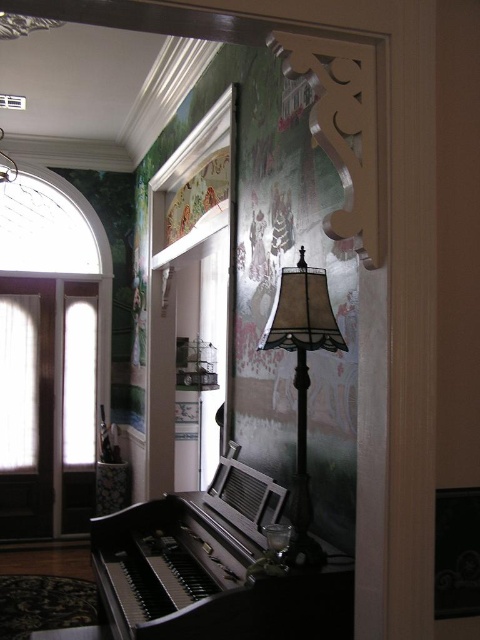
You are a guest in this room and want to sit in a chair that is not in direct sunlight. The black polished piano at lower left and the matte beige lampshade at center are in the room. Based on their positions, which object casts a shadow that might block the sunlight?

The black polished piano at lower left is positioned under the matte beige lampshade at center, so the lampshade might cast a shadow over the piano, providing shade from the sunlight.

You are standing in the center of the room and want to move to the black polished piano at lower left. Which direction should you move first?

Since the black polished piano at lower left is located at point (213, 568), you should move to the left first to reach it.